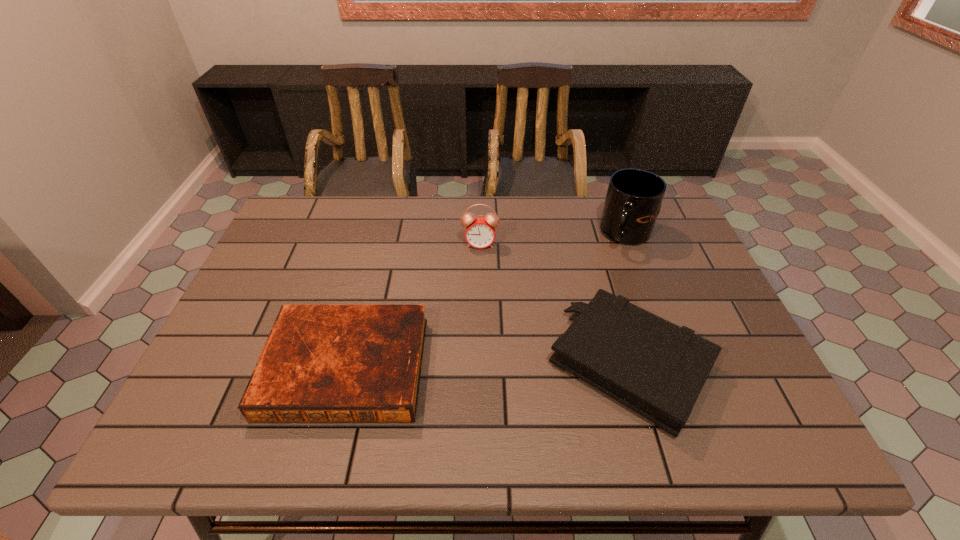
At what (x,y) coordinates should I click in order to perform the action: click on object located in the far right corner section of the desktop. Please return your answer as a coordinate pair (x, y). The height and width of the screenshot is (540, 960). Looking at the image, I should click on (633, 201).

Locate an element on the screen. The height and width of the screenshot is (540, 960). object that is at the near right corner is located at coordinates (657, 369).

In the image, there is a desktop. Identify the location of vacant region at the far edge. (435, 199).

Find the location of a particular element. Image resolution: width=960 pixels, height=540 pixels. blank space at the near edge of the desktop is located at coordinates (422, 406).

Where is `vacant space at the left edge of the desktop`? vacant space at the left edge of the desktop is located at coordinates (266, 300).

The height and width of the screenshot is (540, 960). In the image, there is a desktop. Find the location of `free space at the right edge`. free space at the right edge is located at coordinates (704, 293).

At what (x,y) coordinates should I click in order to perform the action: click on blank space at the far left corner. Please return your answer as a coordinate pair (x, y). The height and width of the screenshot is (540, 960). Looking at the image, I should click on (321, 197).

The height and width of the screenshot is (540, 960). Identify the location of free area in between the third tallest object and the second object from left to right. [555, 305].

Locate an element on the screen. vacant region between the left Bible and the tallest object is located at coordinates (487, 300).

Locate an element on the screen. The height and width of the screenshot is (540, 960). free point between the shortest object and the second shortest object is located at coordinates (489, 366).